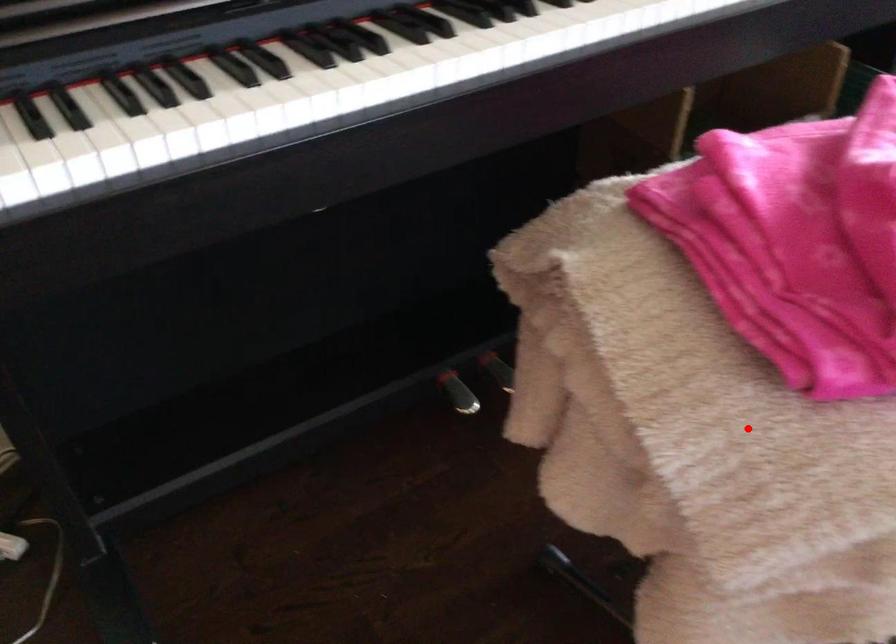
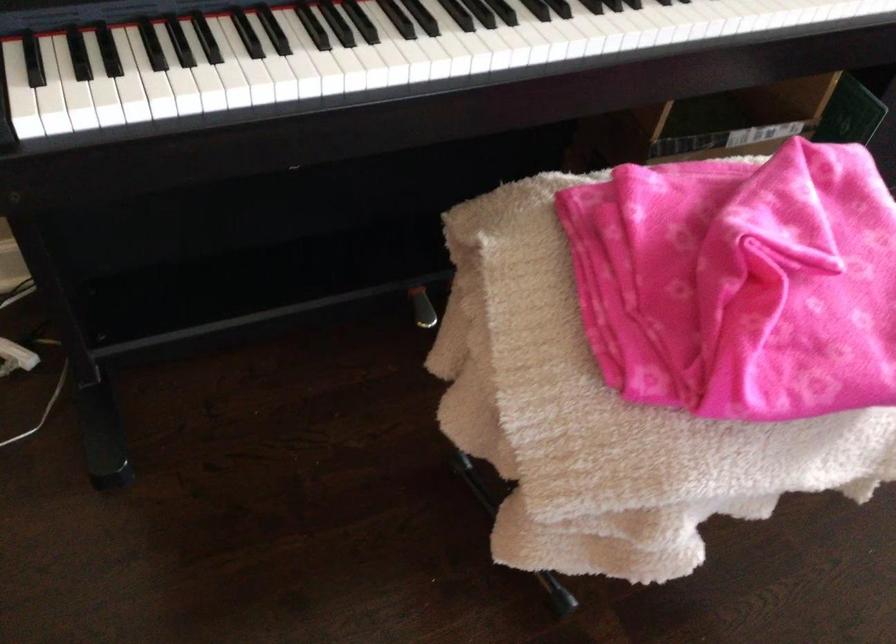
Question: I am providing you with two images of the same scene from different viewpoints. Given a red point in image1, look at the same physical point in image2. Is it:

Choices:
 (A) Closer to the viewpoint
 (B) Farther from the viewpoint

Answer: (B)